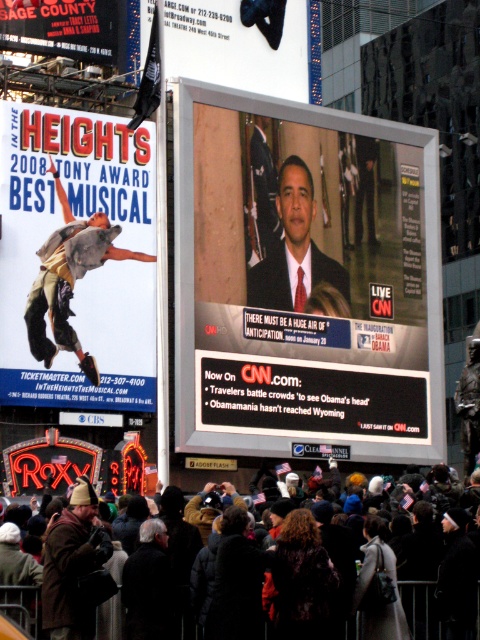
Can you confirm if shiny silver tv at center is thinner than matte black poster at upper left?

Incorrect, shiny silver tv at center's width is not less than matte black poster at upper left's.

Does point (420, 221) come behind point (31, 392)?

Yes, it is.

Between point (402, 129) and point (58, 225), which one is positioned in front?

Point (58, 225) is more forward.

Find the location of a particular element. This screenshot has width=480, height=640. shiny silver tv at center is located at coordinates (311, 278).

Is point (51, 540) positioned behind point (33, 627)?

Yes, it is behind point (33, 627).

Is brown woolen hat at center positioned before black woolen hat at center?

Yes, it is.

The width and height of the screenshot is (480, 640). Find the location of `brown woolen hat at center`. brown woolen hat at center is located at coordinates (74, 566).

This screenshot has width=480, height=640. What do you see at coordinates (311, 278) in the screenshot? I see `shiny silver tv at center` at bounding box center [311, 278].

Is point (181, 154) closer to camera compared to point (33, 36)?

That is False.

You are a GUI agent. You are given a task and a screenshot of the screen. Output one action in this format:
    pyautogui.click(x=<x>, y=<y>)
    Task: Click on the shiny silver tv at center
    Image resolution: width=480 pixels, height=640 pixels.
    Given the screenshot: What is the action you would take?
    pyautogui.click(x=311, y=278)